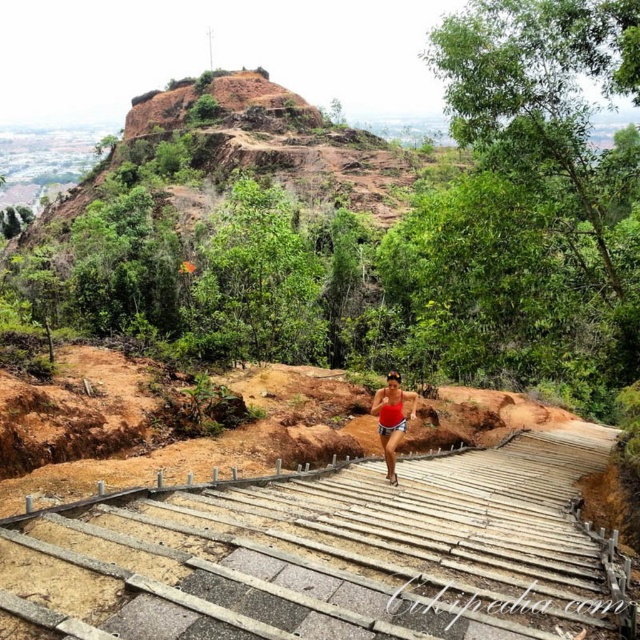
Looking at this image, you are a photographer trying to capture the woman running up the wooden stairs. To get a clear shot of both the wooden stairs at center and the red matte tank top at center, where should you position yourself relative to the woman?

You should position yourself to the left of the woman so that you can see both the wooden stairs at center, which are to the right of the red matte tank top at center, and the red matte tank top at center clearly.

You are standing at the base of the wooden stairs at center. If you were to walk straight ahead, would you be moving towards the top of the stairs or away from it?

Since the wooden stairs at center are positioned at point (x=333, y=554), walking straight ahead from the base would lead you towards the top of the stairs.

You are standing at the base of the wooden staircase and want to reach the top of the hill. You notice two points marked on the path. Which point, point (593, 602) or point (387, 428), is closer to you as you start your climb?

Point (593, 602) is closer to you than point (387, 428) because it is nearer to the camera position at the base of the staircase.